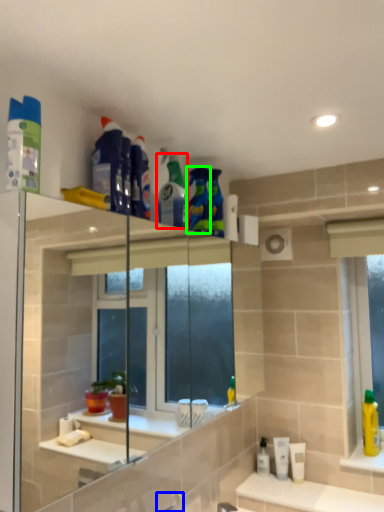
Question: Based on their relative distances, which object is farther from cleaning product (highlighted by a red box)? Choose from faucet (highlighted by a blue box) and cleaning product (highlighted by a green box).

Choices:
 (A) faucet
 (B) cleaning product

Answer: (A)